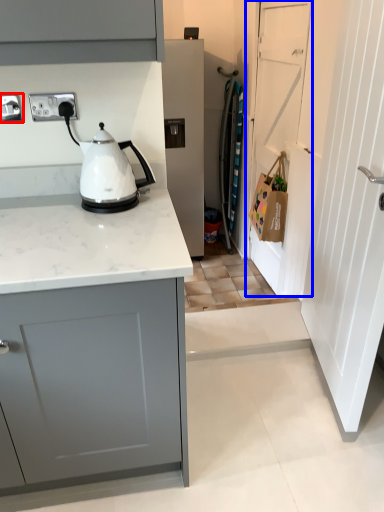
Question: Which of the following is the closest to the observer, electric outlet (highlighted by a red box) or door (highlighted by a blue box)?

Choices:
 (A) electric outlet
 (B) door

Answer: (A)